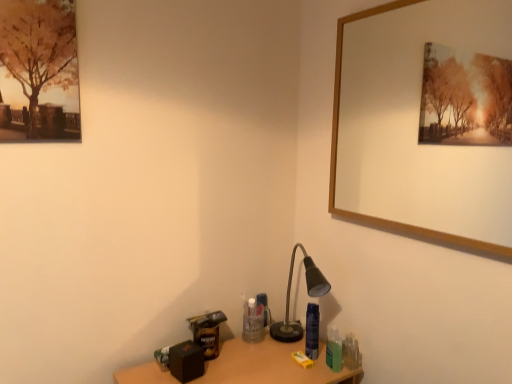
Where is `free area below matte black desk lamp at lower right (from a real-world perspective)`? This screenshot has height=384, width=512. free area below matte black desk lamp at lower right (from a real-world perspective) is located at coordinates (295, 337).